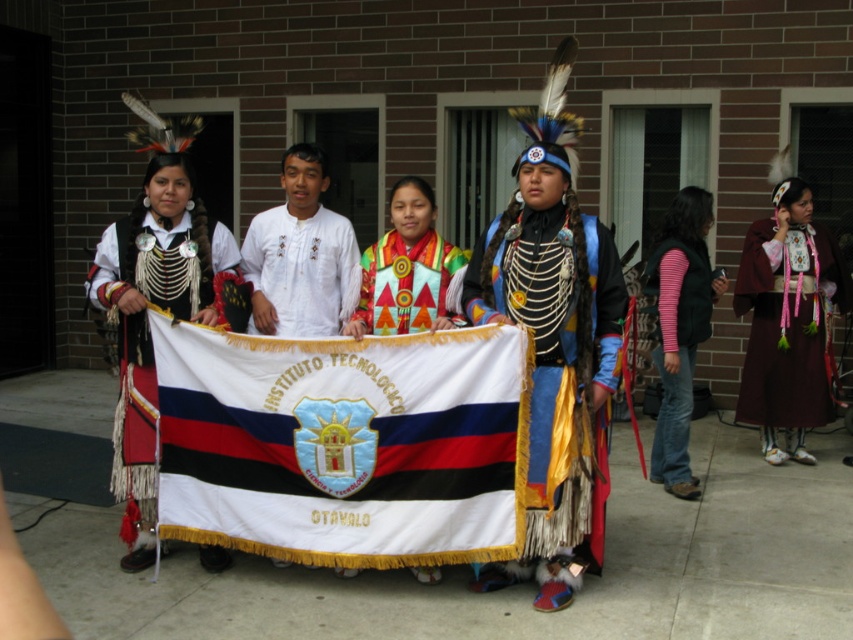
What do you see at coordinates (408, 269) in the screenshot? I see `embroidered fabric shawl at center` at bounding box center [408, 269].

This screenshot has width=853, height=640. What are the coordinates of `embroidered fabric shawl at center` in the screenshot? It's located at (408, 269).

This screenshot has height=640, width=853. What are the coordinates of `matte black and white fabric at center` in the screenshot? It's located at (148, 324).

Between point (142, 224) and point (450, 273), which one is positioned behind?

Positioned behind is point (142, 224).

What are the coordinates of `matte black and white fabric at center` in the screenshot? It's located at (148, 324).

Can you confirm if white fabric flag at center is taller than shiny metallic headdress at center?

No, white fabric flag at center is not taller than shiny metallic headdress at center.

Who is taller, white fabric flag at center or shiny metallic headdress at center?

Standing taller between the two is shiny metallic headdress at center.

You are a GUI agent. You are given a task and a screenshot of the screen. Output one action in this format:
    pyautogui.click(x=<x>, y=<y>)
    Task: Click on the white fabric flag at center
    
    Given the screenshot: What is the action you would take?
    pyautogui.click(x=343, y=444)

The height and width of the screenshot is (640, 853). Identify the location of white fabric flag at center. (343, 444).